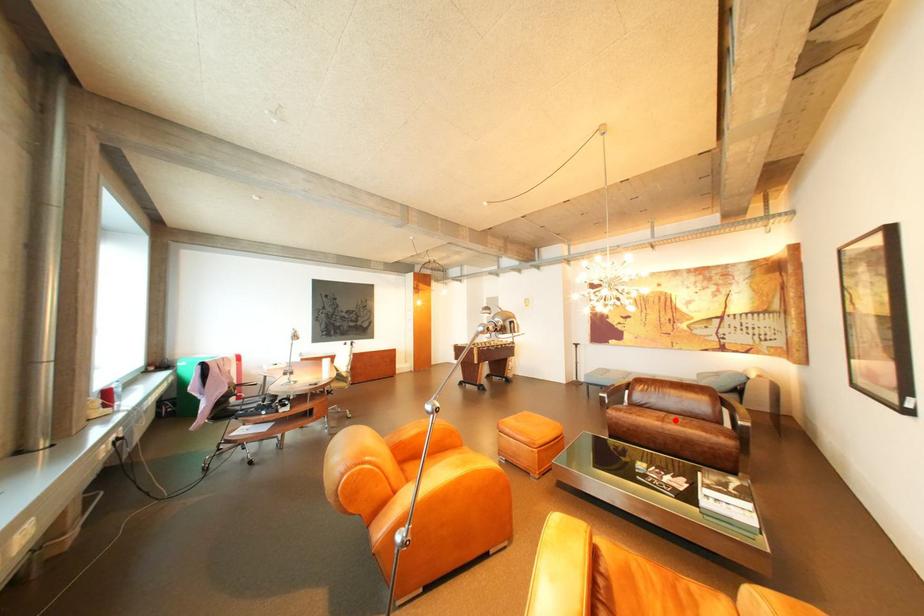
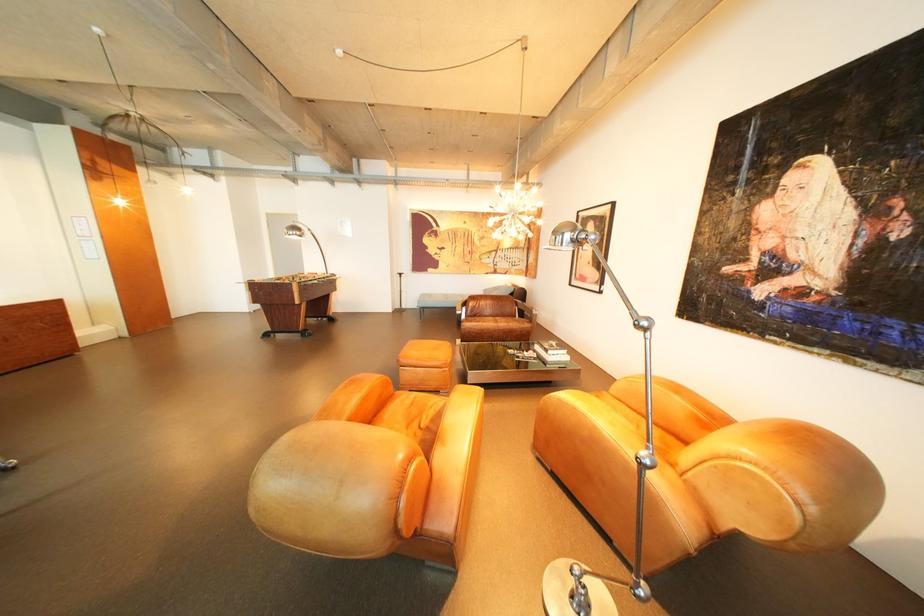
Question: I am providing you with two images of the same scene from different viewpoints. A red point is marked on the first image. Is the red point's position out of view in image 2?

Choices:
 (A) Yes
 (B) No

Answer: (B)